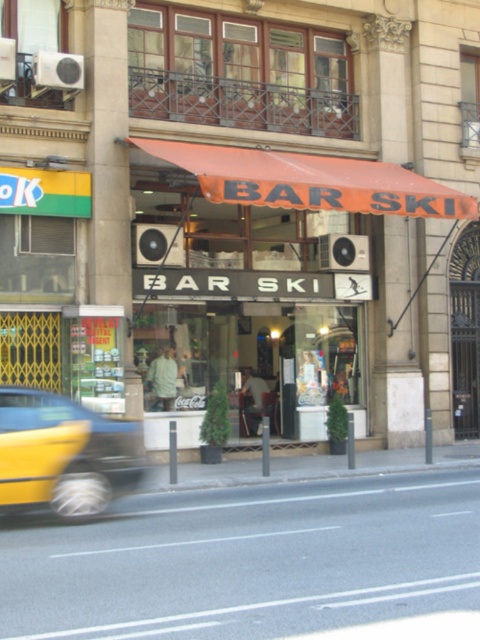
Question: Does yellow rubber tire at lower left come behind yellow matte taxi at left?

Choices:
 (A) no
 (B) yes

Answer: (A)

Question: Which object is farther from the camera taking this photo?

Choices:
 (A) orange fabric awning at center
 (B) yellow matte taxi at left

Answer: (A)

Question: Can you confirm if orange fabric awning at center is positioned above yellow matte taxi at left?

Choices:
 (A) yes
 (B) no

Answer: (A)

Question: Is the position of yellow rubber tire at lower left less distant than that of orange fabric awning at center?

Choices:
 (A) no
 (B) yes

Answer: (B)

Question: Which object appears farthest from the camera in this image?

Choices:
 (A) yellow matte taxi at left
 (B) yellow rubber tire at lower left

Answer: (A)

Question: Estimate the real-world distances between objects in this image. Which object is closer to the yellow rubber tire at lower left?

Choices:
 (A) orange fabric awning at center
 (B) yellow matte taxi at left

Answer: (B)